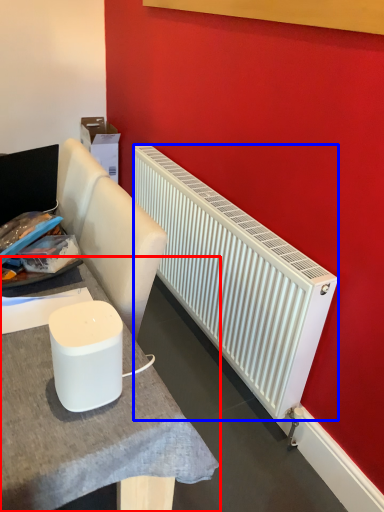
Question: Which object is further to the camera taking this photo, table (highlighted by a red box) or radiator (highlighted by a blue box)?

Choices:
 (A) table
 (B) radiator

Answer: (B)